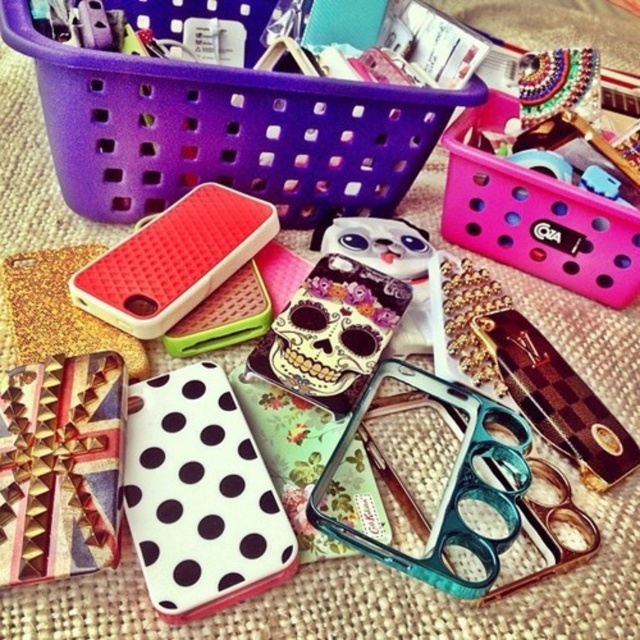
Is purple plastic basket at upper left bigger than matte skull case at center?

Correct, purple plastic basket at upper left is larger in size than matte skull case at center.

Image resolution: width=640 pixels, height=640 pixels. Identify the location of purple plastic basket at upper left. (221, 122).

Measure the distance between pink plastic basket at upper right and matte skull case at center.

They are 14.01 inches apart.

Does pink plastic basket at upper right appear over matte skull case at center?

Indeed, pink plastic basket at upper right is positioned over matte skull case at center.

Who is more forward, (502,179) or (289,376)?

Positioned in front is point (289,376).

Identify the location of pink plastic basket at upper right. Image resolution: width=640 pixels, height=640 pixels. (536, 216).

Does purple plastic basket at upper left have a smaller size compared to pink plastic basket at upper right?

Actually, purple plastic basket at upper left might be larger than pink plastic basket at upper right.

Who is more distant from viewer, (320, 154) or (531, 273)?

The point (531, 273) is behind.

Where is `purple plastic basket at upper left`? purple plastic basket at upper left is located at coordinates (221, 122).